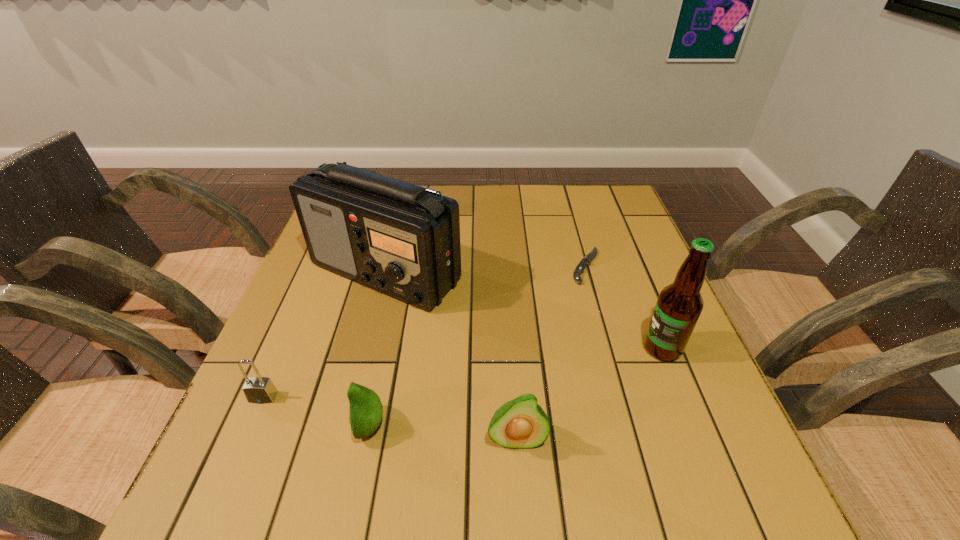
Locate an element on the screen. unoccupied area between the fourth farthest object and the right avocado is located at coordinates (x=390, y=418).

This screenshot has width=960, height=540. In order to click on free spot between the right avocado and the radio receiver in this screenshot , I will do `click(451, 356)`.

Locate an element on the screen. vacant space in between the pocketknife and the taller avocado is located at coordinates (551, 353).

Identify the location of vacant area that lies between the pocketknife and the shorter avocado. (478, 346).

Find the location of a particular element. This screenshot has width=960, height=540. unoccupied area between the taller avocado and the second object from right to left is located at coordinates (551, 353).

Image resolution: width=960 pixels, height=540 pixels. I want to click on vacant space in between the third nearest object and the third farthest object, so click(463, 373).

Identify the location of empty space that is in between the beer bottle and the fifth object from left to right. (624, 307).

You are a GUI agent. You are given a task and a screenshot of the screen. Output one action in this format:
    pyautogui.click(x=<x>, y=<y>)
    Task: Click on the object that stands as the fifth closest to the shortest object
    Image resolution: width=960 pixels, height=540 pixels.
    Given the screenshot: What is the action you would take?
    pyautogui.click(x=260, y=390)

Identify which object is the third nearest to the pocketknife. Please provide its 2D coordinates. Your answer should be formatted as a tuple, i.e. [(x, y)], where the tuple contains the x and y coordinates of a point satisfying the conditions above.

[(521, 423)]

Identify the location of blank area in the image that satisfies the following two spatial constraints: 1. on the label of the rightmost object; 2. on the shackle of the padlock. click(682, 397).